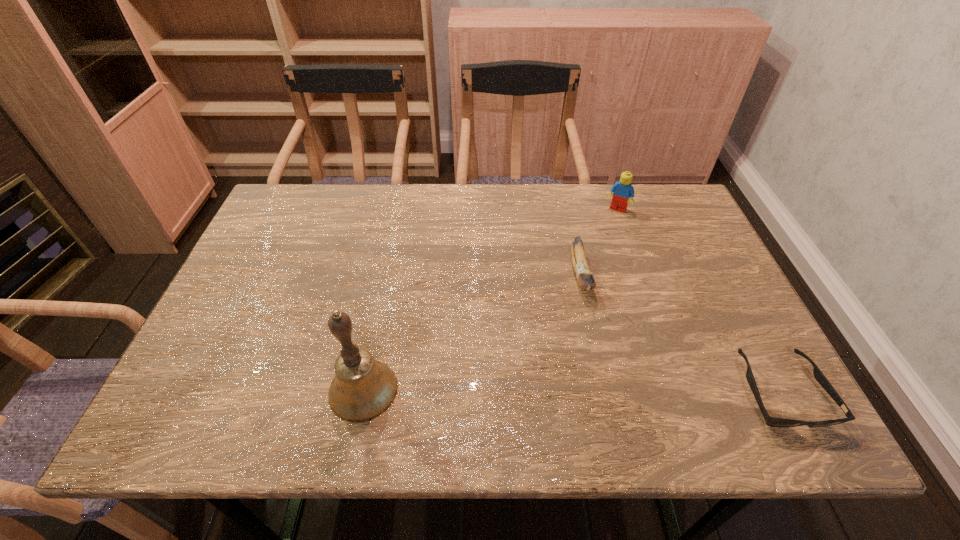
Where is `the tallest object`? the tallest object is located at coordinates [363, 388].

What are the coordinates of `the leftmost object` in the screenshot? It's located at (363, 388).

Identify the location of the shortest object. (819, 376).

This screenshot has width=960, height=540. Find the location of `the rightmost object`. the rightmost object is located at coordinates coord(819,376).

Locate an element on the screen. This screenshot has width=960, height=540. the third object from right to left is located at coordinates (585, 278).

Find the location of `the third tallest object`. the third tallest object is located at coordinates (585, 278).

This screenshot has width=960, height=540. Identify the location of the second object from right to left. (623, 190).

Locate an element on the screen. Lego is located at coordinates (623, 190).

Identify the location of free location located 0.220m on the right of the leftmost object. The image size is (960, 540). (504, 390).

Locate an element on the screen. Image resolution: width=960 pixels, height=540 pixels. free region located on the peel of the third tallest object is located at coordinates (597, 344).